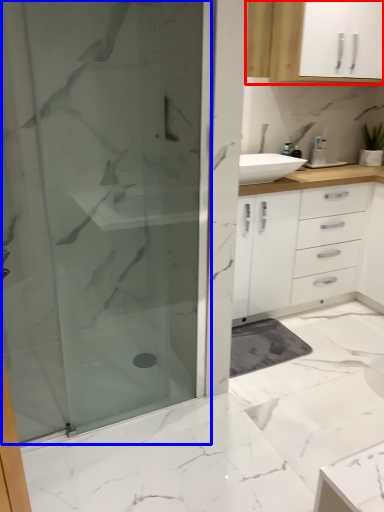
Question: Among these objects, which one is farthest to the camera, cabinetry (highlighted by a red box) or shower door (highlighted by a blue box)?

Choices:
 (A) cabinetry
 (B) shower door

Answer: (A)